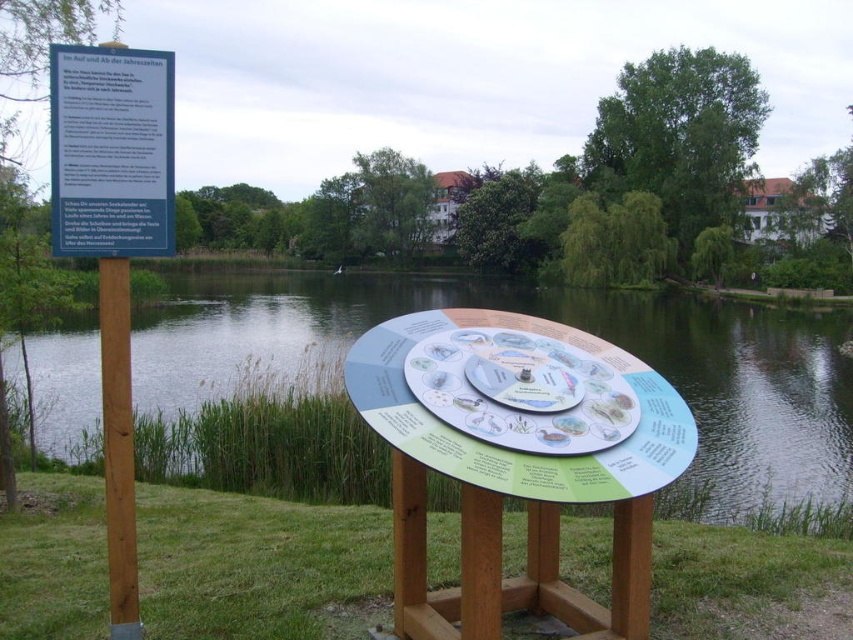
Question: Among these objects, which one is farthest from the camera?

Choices:
 (A) matte plastic circular display at center
 (B) green water at center
 (C) blue plastic sign at upper left
 (D) brown wooden pole at left

Answer: (B)

Question: Can you confirm if green water at center is positioned below brown wooden pole at left?

Choices:
 (A) no
 (B) yes

Answer: (A)

Question: Considering the real-world distances, which object is farthest from the green water at center?

Choices:
 (A) blue plastic sign at upper left
 (B) matte plastic circular display at center
 (C) brown wooden pole at left

Answer: (C)

Question: Which object appears farthest from the camera in this image?

Choices:
 (A) green water at center
 (B) brown wooden pole at left
 (C) blue plastic sign at upper left
 (D) matte plastic circular display at center

Answer: (A)

Question: Does blue plastic sign at upper left appear on the left side of matte plastic circular display at center?

Choices:
 (A) no
 (B) yes

Answer: (B)

Question: Can you confirm if blue plastic sign at upper left is positioned above matte plastic circular display at center?

Choices:
 (A) no
 (B) yes

Answer: (B)